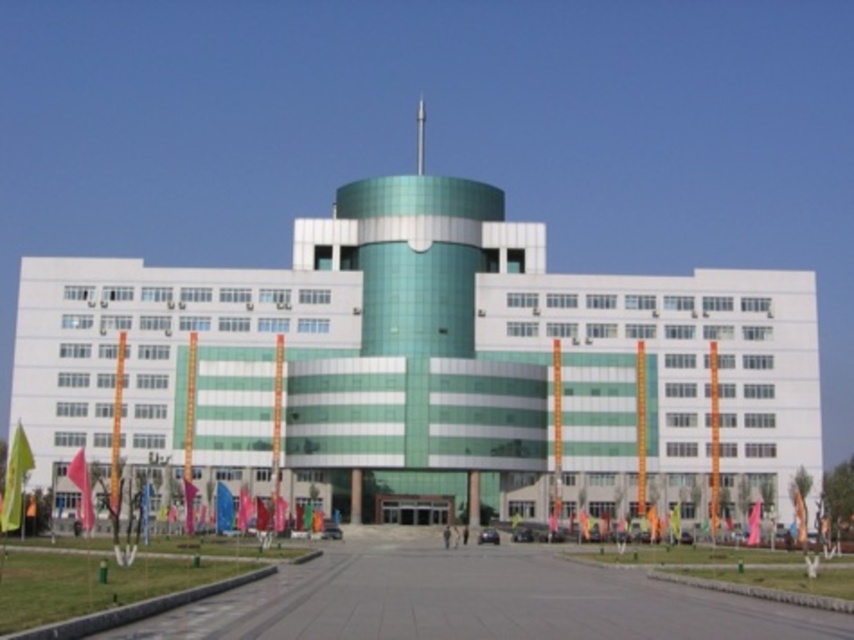
Who is lower down, green glass building at center or green fabric flag at center?

green fabric flag at center is below.

Which is in front, point (483, 452) or point (753, 516)?

Point (753, 516) is more forward.

I want to click on green glass building at center, so click(425, 364).

Does green glass building at center appear on the right side of red fabric flag at lower left?

Yes, green glass building at center is to the right of red fabric flag at lower left.

Locate an element on the screen. The width and height of the screenshot is (854, 640). green glass building at center is located at coordinates coord(425,364).

Can you confirm if green fabric flag at lower left is taller than green fabric flag at lower right?

Yes, green fabric flag at lower left is taller than green fabric flag at lower right.

Who is more distant from viewer, (21, 483) or (796, 536)?

Point (796, 536)

Identify the location of green fabric flag at lower left. (15, 477).